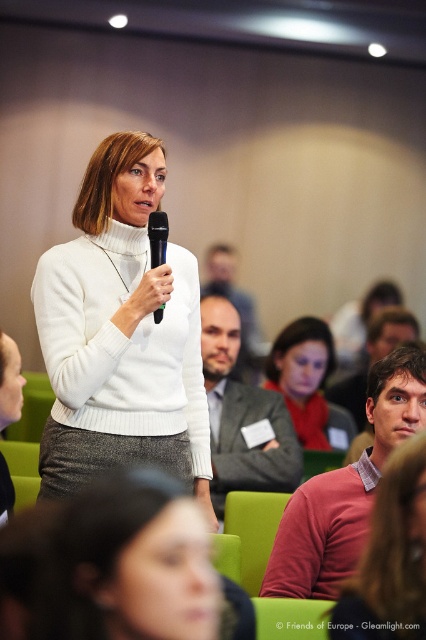
Question: Can you confirm if matte pink sweater at center is positioned to the left of green plastic microphone at center?

Choices:
 (A) no
 (B) yes

Answer: (A)

Question: Which of the following is the farthest from the observer?

Choices:
 (A) (271, 440)
 (B) (405, 477)
 (C) (173, 429)

Answer: (A)

Question: Which point is closer to the camera?

Choices:
 (A) (x=354, y=525)
 (B) (x=322, y=358)
 (C) (x=420, y=449)
 (D) (x=298, y=460)

Answer: (C)

Question: Which object is farther from the camera taking this photo?

Choices:
 (A) matte gray sweater at center
 (B) green plastic microphone at center
 (C) matte pink sweater at center
 (D) white knitwear at center

Answer: (A)

Question: Is white knitwear at center to the right of matte white sweater at center from the viewer's perspective?

Choices:
 (A) no
 (B) yes

Answer: (A)

Question: Can you confirm if white knitwear at center is thinner than matte gray sweater at center?

Choices:
 (A) yes
 (B) no

Answer: (B)